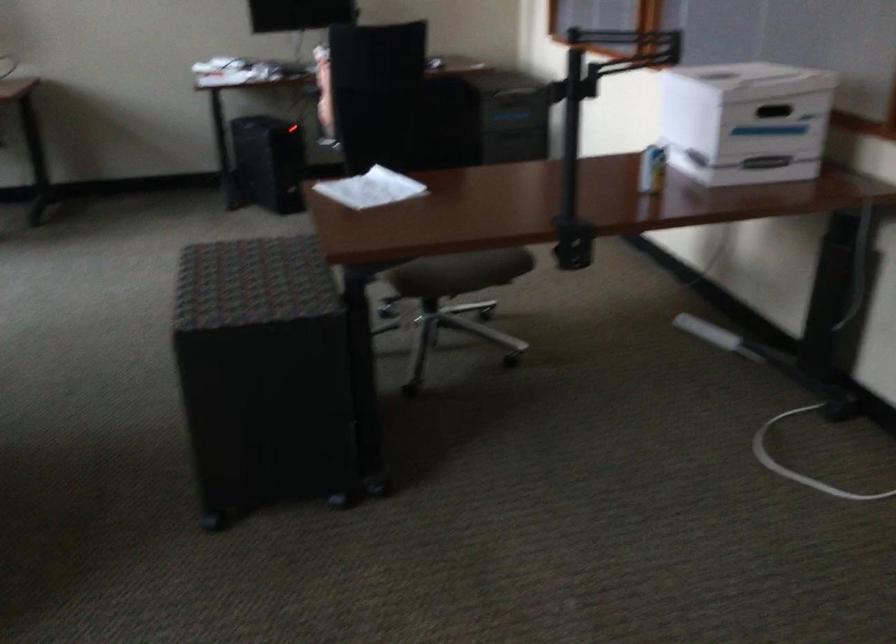
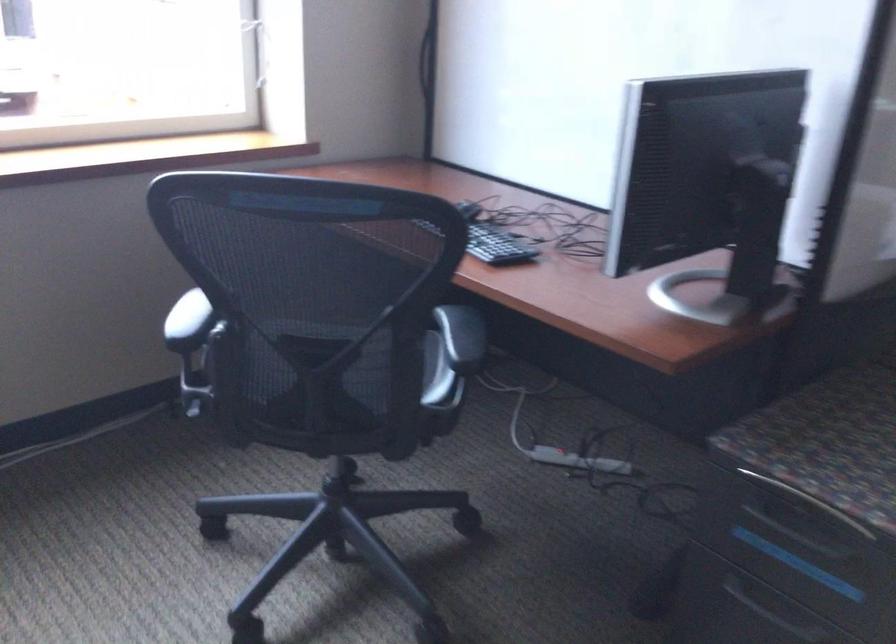
Question: How did the camera likely rotate?

Choices:
 (A) Left
 (B) Right
 (C) Up
 (D) Down

Answer: (A)